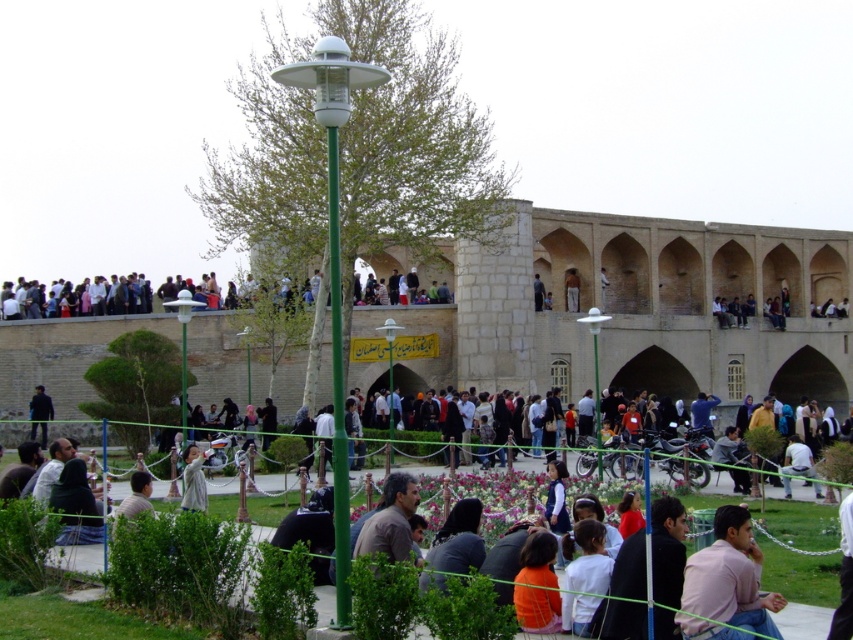
Between pink cotton shirt at lower right and multicolored clothing at upper center, which one is positioned lower?

Positioned lower is pink cotton shirt at lower right.

Between point (730, 605) and point (82, 291), which one is positioned behind?

The point (82, 291) is behind.

Locate an element on the screen. pink cotton shirt at lower right is located at coordinates (730, 577).

Is multicolored clothing at upper center behind light brown leather jacket at upper center?

No, multicolored clothing at upper center is in front of light brown leather jacket at upper center.

Measure the distance between multicolored clothing at upper center and camera.

81.61 meters

Where is `multicolored clothing at upper center`? The width and height of the screenshot is (853, 640). multicolored clothing at upper center is located at coordinates coord(22,292).

Can you confirm if pink cotton shirt at lower right is taller than light brown wooden pole at upper center?

In fact, pink cotton shirt at lower right may be shorter than light brown wooden pole at upper center.

Does pink cotton shirt at lower right have a larger size compared to light brown wooden pole at upper center?

Actually, pink cotton shirt at lower right might be smaller than light brown wooden pole at upper center.

Locate an element on the screen. pink cotton shirt at lower right is located at coordinates (730, 577).

Find the location of a particular element. pink cotton shirt at lower right is located at coordinates (730, 577).